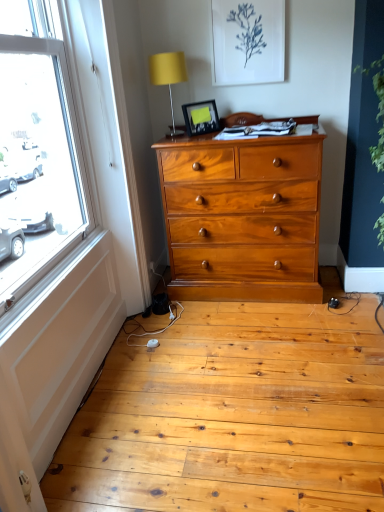
Locate an element on the screen. This screenshot has width=384, height=512. matte yellow fabric at upper center is located at coordinates (168, 75).

Measure the distance between point (207, 116) and camera.

8.12 feet.

Locate an element on the screen. This screenshot has height=512, width=384. green leafy plant at right is located at coordinates (378, 109).

Locate an element on the screen. This screenshot has width=384, height=512. matte yellow fabric at upper center is located at coordinates (168, 75).

Is matte black picture frame at upper center surrounded by green leafy plant at right?

No.

From a real-world perspective, is green leafy plant at right below matte black picture frame at upper center?

Yes, from a real-world perspective, green leafy plant at right is below matte black picture frame at upper center.

Considering the positions of point (380, 93) and point (200, 127), is point (380, 93) closer or farther from the camera than point (200, 127)?

Point (380, 93) appears to be closer to the viewer than point (200, 127).

Does green leafy plant at right have a greater width compared to matte black picture frame at upper center?

Answer: Indeed, green leafy plant at right has a greater width compared to matte black picture frame at upper center.

From the image's perspective, is matte black picture frame at upper center over green leafy plant at right?

Yes, from the image's perspective, matte black picture frame at upper center is on top of green leafy plant at right.

From a real-world perspective, is matte black picture frame at upper center positioned above or below green leafy plant at right?

In terms of real-world spatial position, matte black picture frame at upper center is above green leafy plant at right.

Identify the location of plant in front of the matte black picture frame at upper center. (378, 109).

Between matte black picture frame at upper center and green leafy plant at right, which one has larger width?

Wider between the two is green leafy plant at right.

Considering the positions of objects matte black picture frame at upper center and matte yellow fabric at upper center in the image provided, who is in front, matte black picture frame at upper center or matte yellow fabric at upper center?

matte yellow fabric at upper center is more forward.

Is matte black picture frame at upper center thinner than matte yellow fabric at upper center?

Yes, matte black picture frame at upper center is thinner than matte yellow fabric at upper center.

Is point (219, 125) positioned in front of point (170, 82)?

That is False.

Is matte yellow fabric at upper center to the right of matte black picture frame at upper center from the viewer's perspective?

No, matte yellow fabric at upper center is not to the right of matte black picture frame at upper center.

Considering the sizes of objects matte yellow fabric at upper center and matte black picture frame at upper center in the image provided, who is shorter, matte yellow fabric at upper center or matte black picture frame at upper center?

matte black picture frame at upper center is shorter.

From a real-world perspective, which object rests below the other?

matte black picture frame at upper center is physically lower.

Based on the photo, looking at their sizes, would you say matte yellow fabric at upper center is wider or thinner than matte black picture frame at upper center?

Clearly, matte yellow fabric at upper center has more width compared to matte black picture frame at upper center.

Identify the location of plant located in front of the matte yellow fabric at upper center. (378, 109).

Between green leafy plant at right and matte yellow fabric at upper center, which one is positioned in front?

green leafy plant at right.

Is green leafy plant at right positioned beyond the bounds of matte yellow fabric at upper center?

Indeed, green leafy plant at right is completely outside matte yellow fabric at upper center.

From the image's perspective, who appears lower, green leafy plant at right or matte yellow fabric at upper center?

green leafy plant at right is shown below in the image.

Could you tell me if matte yellow fabric at upper center is turned towards green leafy plant at right?

No, matte yellow fabric at upper center is not facing towards green leafy plant at right.

Identify the location of table lamp that appears above the green leafy plant at right (from a real-world perspective). (168, 75).

Is matte yellow fabric at upper center thinner than green leafy plant at right?

Correct, the width of matte yellow fabric at upper center is less than that of green leafy plant at right.

Are matte yellow fabric at upper center and green leafy plant at right making contact?

No, matte yellow fabric at upper center is not in contact with green leafy plant at right.

Locate an element on the screen. Image resolution: width=384 pixels, height=512 pixels. picture frame behind the green leafy plant at right is located at coordinates (x=201, y=117).

You are a GUI agent. You are given a task and a screenshot of the screen. Output one action in this format:
    pyautogui.click(x=<x>, y=<y>)
    Task: Click on the picture frame above the green leafy plant at right (from a real-world perspective)
    The image size is (384, 512).
    Given the screenshot: What is the action you would take?
    pyautogui.click(x=201, y=117)

When comparing their distances from matte yellow fabric at upper center, does green leafy plant at right or matte black picture frame at upper center seem further?

green leafy plant at right is positioned further to the anchor matte yellow fabric at upper center.

Based on their spatial positions, is matte yellow fabric at upper center or green leafy plant at right further from matte black picture frame at upper center?

Based on the image, green leafy plant at right appears to be further to matte black picture frame at upper center.

When comparing their distances from green leafy plant at right, does matte black picture frame at upper center or matte yellow fabric at upper center seem closer?

Among the two, matte black picture frame at upper center is located nearer to green leafy plant at right.

Looking at the image, which one is located further to green leafy plant at right, matte yellow fabric at upper center or matte black picture frame at upper center?

matte yellow fabric at upper center.

Looking at the image, which one is located closer to matte black picture frame at upper center, green leafy plant at right or matte yellow fabric at upper center?

The object closer to matte black picture frame at upper center is matte yellow fabric at upper center.

When comparing their distances from matte yellow fabric at upper center, does matte black picture frame at upper center or green leafy plant at right seem closer?

matte black picture frame at upper center is closer to matte yellow fabric at upper center.

I want to click on picture frame between matte yellow fabric at upper center and green leafy plant at right in the horizontal direction, so click(201, 117).